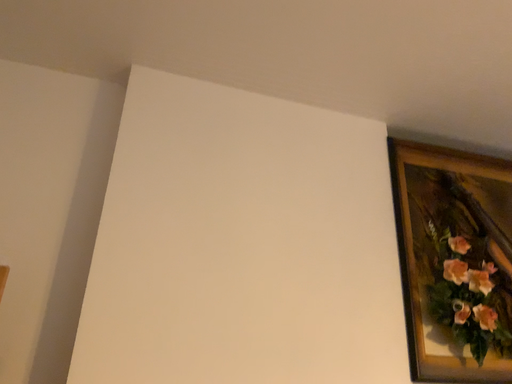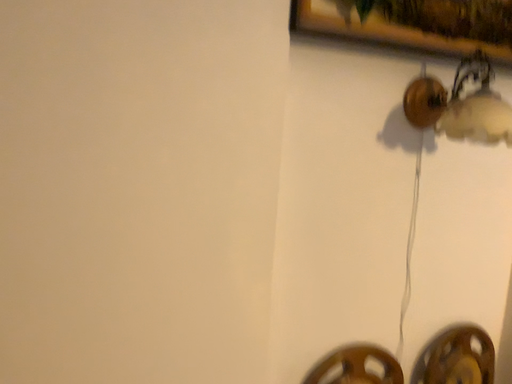
Question: Which way did the camera rotate in the video?

Choices:
 (A) rotated downward
 (B) rotated upward

Answer: (A)